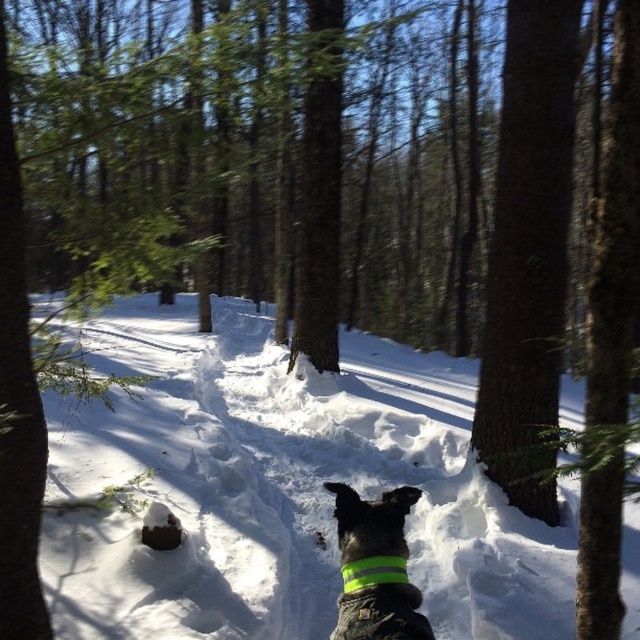
Question: In this image, where is white fluffy snow at center located relative to dark brown bark at center right?

Choices:
 (A) left
 (B) right

Answer: (A)

Question: Which object is positioned closest to the green reflective band at center?

Choices:
 (A) reflective fabric dog at center
 (B) white fluffy snow at center

Answer: (A)

Question: Can you confirm if dark brown bark at center right is bigger than reflective fabric dog at center?

Choices:
 (A) yes
 (B) no

Answer: (A)

Question: Which object is farther from the camera taking this photo?

Choices:
 (A) dark brown bark at center right
 (B) white fluffy snow at center

Answer: (A)

Question: Which object appears closest to the camera in this image?

Choices:
 (A) green reflective band at center
 (B) reflective fabric dog at center

Answer: (B)

Question: Is dark brown bark at center right positioned before green reflective band at center?

Choices:
 (A) no
 (B) yes

Answer: (A)